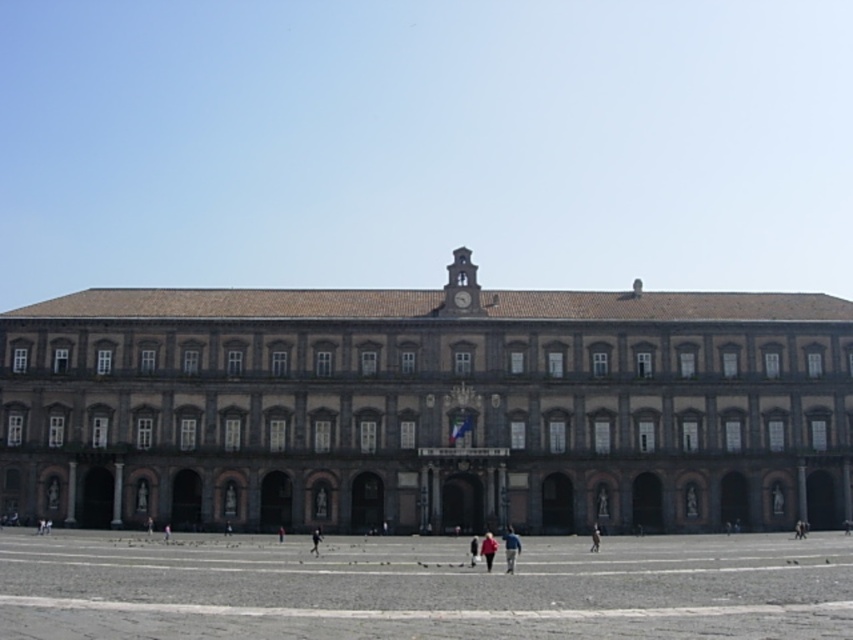
You are a tourist standing in front of the brown stone building at center and the gray stone pavement at lower center. Which object is wider in terms of their horizontal span?

The brown stone building at center is wider than the gray stone pavement at lower center.

You are a photographer planning to take a picture of the grand historical building. You want to ensure both the red fabric person at center and the dark brown leather jacket at center are clearly visible in the frame. Based on their positions, which object might require adjusting the camera angle to avoid being too wide and blocking the building?

The red fabric person at center might be wider than the dark brown leather jacket at center, so adjusting the camera angle to account for its width could help ensure both are visible without blocking the building.